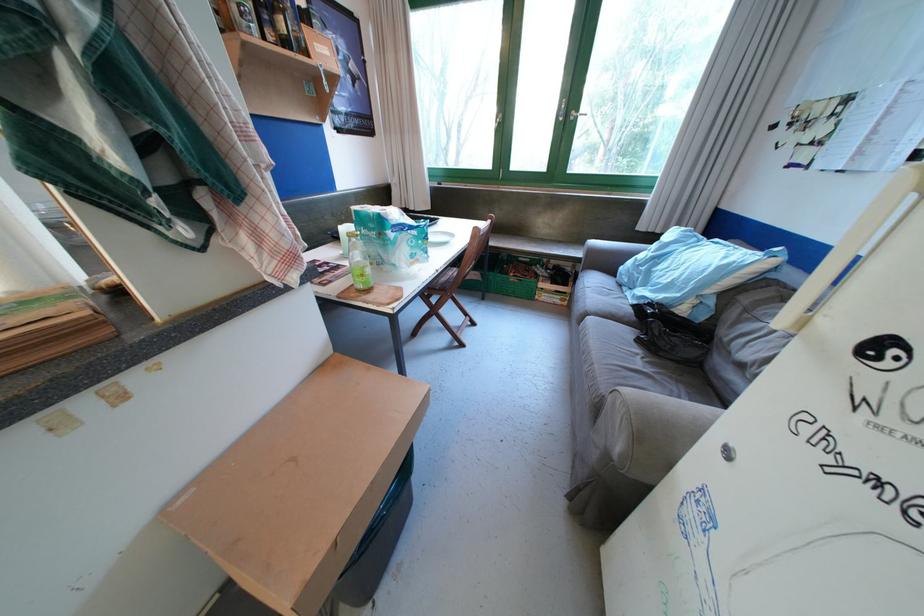
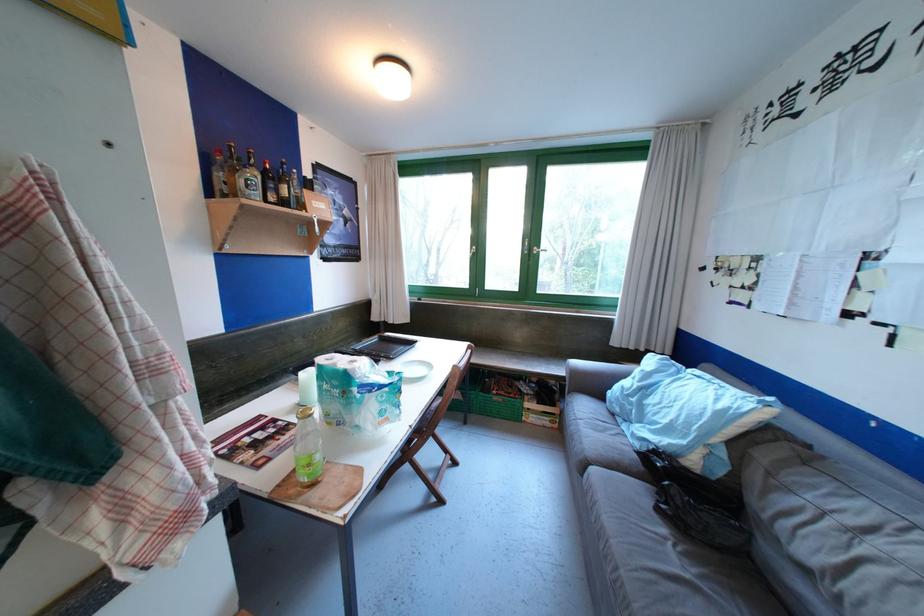
In the second image, find the point that corresponds to pixel 645 353 in the first image.

(671, 532)